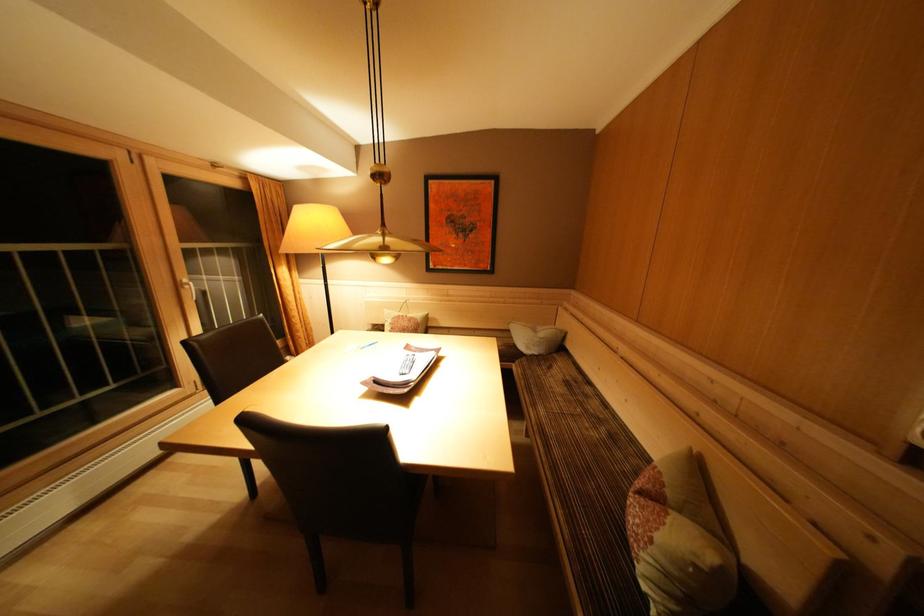
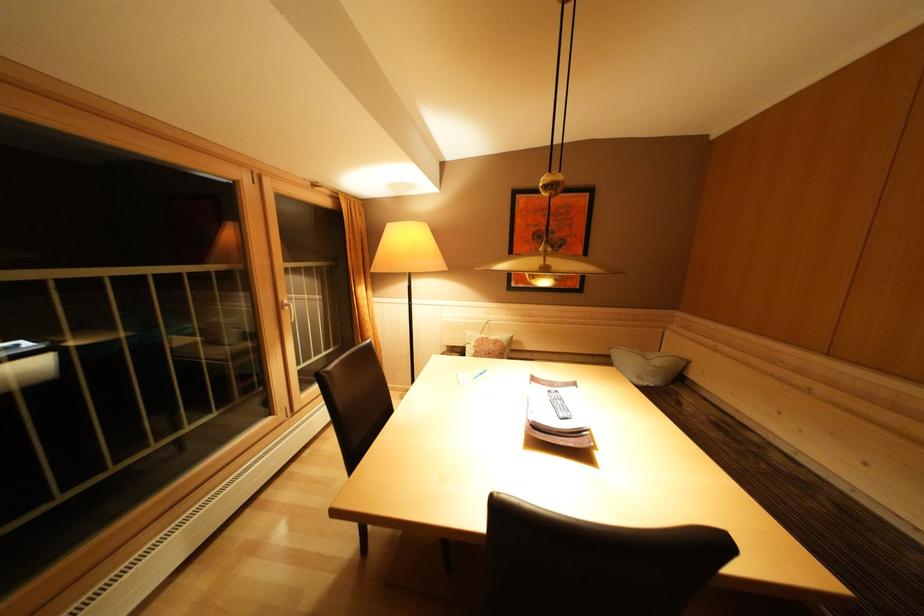
Question: Based on the continuous images, in which direction is the camera rotating? Reply with the corresponding letter.

Choices:
 (A) Left
 (B) Right
 (C) Up
 (D) Down

Answer: (A)